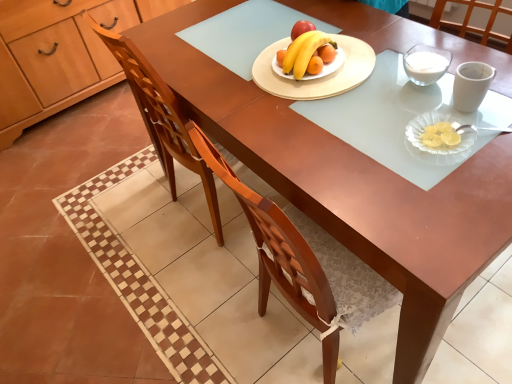
At what (x,y) coordinates should I click in order to perform the action: click on free spot to the right of wooden round platter at center, the first platter viewed from the top. Please return your answer as a coordinate pair (x, y). Looking at the image, I should click on (404, 48).